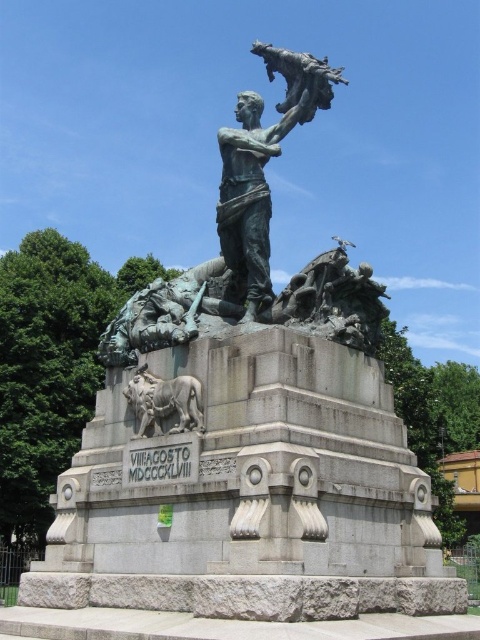
Consider the image. You are an art conservator examining the monument. You notice two points of concern on the sculpture. The first point is at coordinate point (271,288), and the second is at point (199,424). Which point is closer to you?

Point (271,288) is further to the viewer than point (199,424), so the point closer to you is point (199,424).

You are standing in front of the monument and want to take a photo of the bronze statue at center and the sculpted stone lion at lower left. Which object should you focus on first if you want to include both in the frame without moving your camera?

The bronze statue at center is located above the sculpted stone lion at lower left, so you should focus on the bronze statue at center first to ensure both are in the frame.

You are a tourist standing in front of the monument and want to take a photo that includes both the bronze statue at center and the sculpted stone lion at lower left. Based on their positions, which object should you place on the left side of your photo to ensure both are in frame?

The sculpted stone lion at lower left should be placed on the left side of your photo because the bronze statue at center is to the right of the sculpted stone lion at lower left.